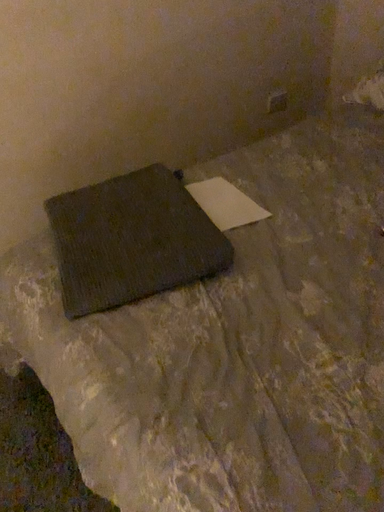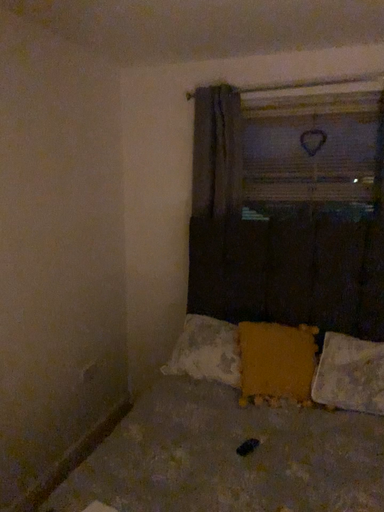
Question: Which way did the camera rotate in the video?

Choices:
 (A) rotated left
 (B) rotated right

Answer: (B)